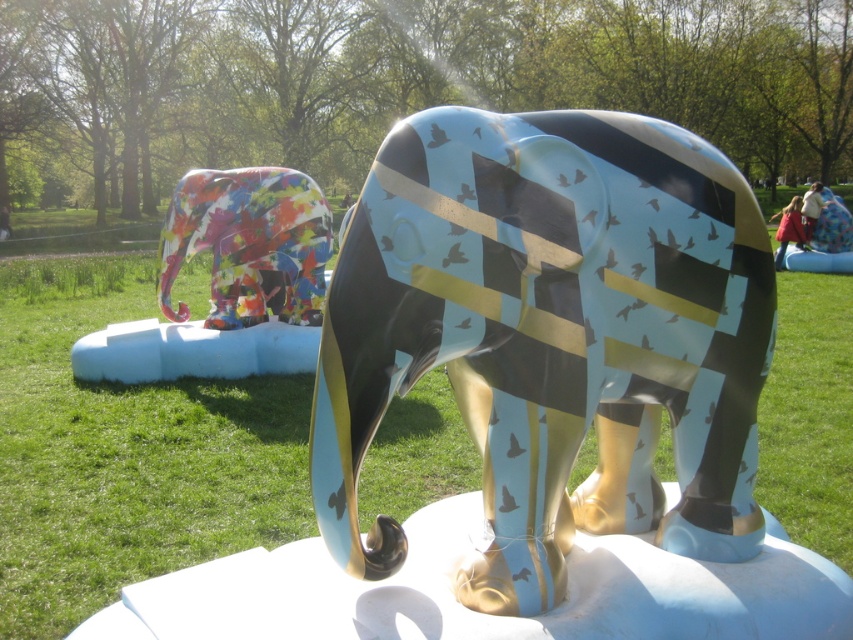
Which of these two, shiny metallic elephant at center or multicolored glossy elephant at left, stands taller?

Standing taller between the two is multicolored glossy elephant at left.

Between shiny metallic elephant at center and multicolored glossy elephant at left, which one is positioned lower?

shiny metallic elephant at center is lower down.

You are a GUI agent. You are given a task and a screenshot of the screen. Output one action in this format:
    pyautogui.click(x=<x>, y=<y>)
    Task: Click on the shiny metallic elephant at center
    This screenshot has height=640, width=853.
    Given the screenshot: What is the action you would take?
    pyautogui.click(x=550, y=337)

Locate an element on the screen. The height and width of the screenshot is (640, 853). shiny metallic elephant at center is located at coordinates pyautogui.click(x=550, y=337).

Which is in front, point (68, 448) or point (256, 308)?

Point (68, 448) is in front.

Does green grass at center lie in front of multicolored glossy elephant at left?

Yes.

This screenshot has width=853, height=640. Describe the element at coordinates (126, 454) in the screenshot. I see `green grass at center` at that location.

Find the location of `green grass at center`. green grass at center is located at coordinates (126, 454).

Does shiny metallic elephant at center lie behind green grass at center?

No, it is not.

Does point (451, 173) lie behind point (213, 401)?

No.

Who is more forward, (357, 307) or (15, 285)?

Point (357, 307) is in front.

Where is `shiny metallic elephant at center`? This screenshot has height=640, width=853. shiny metallic elephant at center is located at coordinates (550, 337).